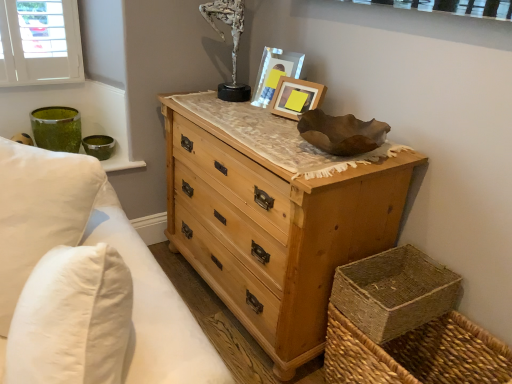
Question: From a real-world perspective, is matte wooden picture frame at upper center, the 1th picture frame when ordered from back to front, physically below natural wood chest of drawers at center?

Choices:
 (A) yes
 (B) no

Answer: (B)

Question: Considering the relative positions of matte wooden picture frame at upper center, the 2th picture frame positioned from the front, and natural wood chest of drawers at center in the image provided, is matte wooden picture frame at upper center, the 2th picture frame positioned from the front, to the left of natural wood chest of drawers at center from the viewer's perspective?

Choices:
 (A) yes
 (B) no

Answer: (B)

Question: From a real-world perspective, is matte wooden picture frame at upper center, the 1th picture frame when ordered from back to front, on top of natural wood chest of drawers at center?

Choices:
 (A) no
 (B) yes

Answer: (B)

Question: Does matte wooden picture frame at upper center, the 1th picture frame when ordered from back to front, have a larger size compared to natural wood chest of drawers at center?

Choices:
 (A) yes
 (B) no

Answer: (B)

Question: Does matte wooden picture frame at upper center, the 1th picture frame when ordered from back to front, have a lesser height compared to natural wood chest of drawers at center?

Choices:
 (A) yes
 (B) no

Answer: (A)

Question: From the image's perspective, is matte wooden picture frame at upper center, the 1th picture frame when ordered from back to front, beneath natural wood chest of drawers at center?

Choices:
 (A) yes
 (B) no

Answer: (B)

Question: Can we say woven natural basket at lower right lies outside natural wood chest of drawers at center?

Choices:
 (A) no
 (B) yes

Answer: (B)

Question: Is woven natural basket at lower right directly adjacent to natural wood chest of drawers at center?

Choices:
 (A) yes
 (B) no

Answer: (B)

Question: Is woven natural basket at lower right behind natural wood chest of drawers at center?

Choices:
 (A) yes
 (B) no

Answer: (A)

Question: Is woven natural basket at lower right bigger than natural wood chest of drawers at center?

Choices:
 (A) yes
 (B) no

Answer: (B)

Question: Is natural wood chest of drawers at center inside woven natural basket at lower right?

Choices:
 (A) yes
 (B) no

Answer: (B)

Question: From a real-world perspective, is woven natural basket at lower right located beneath natural wood chest of drawers at center?

Choices:
 (A) no
 (B) yes

Answer: (A)

Question: Is white cotton pillows at left located outside matte wooden picture frame at upper center, the 1th picture frame when ordered from back to front?

Choices:
 (A) no
 (B) yes

Answer: (B)